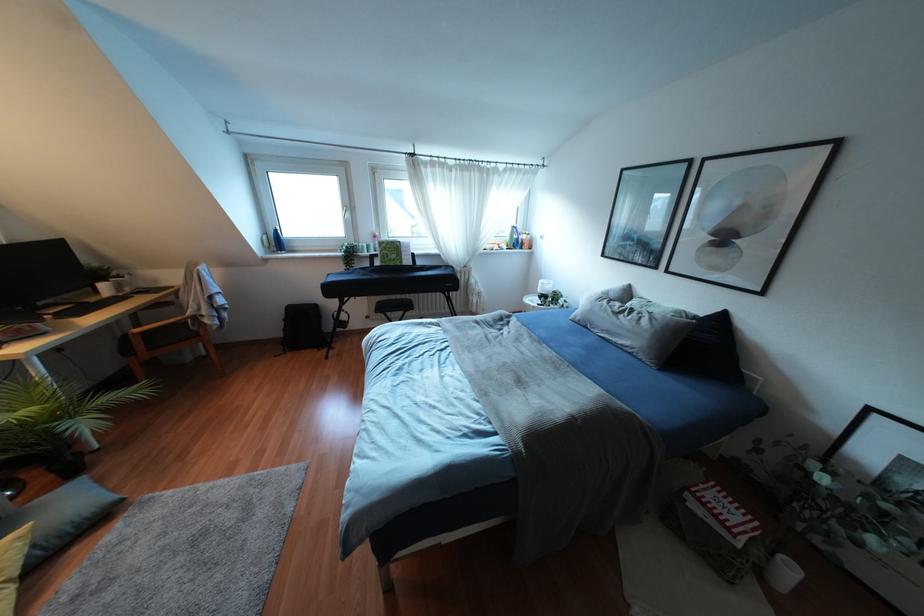
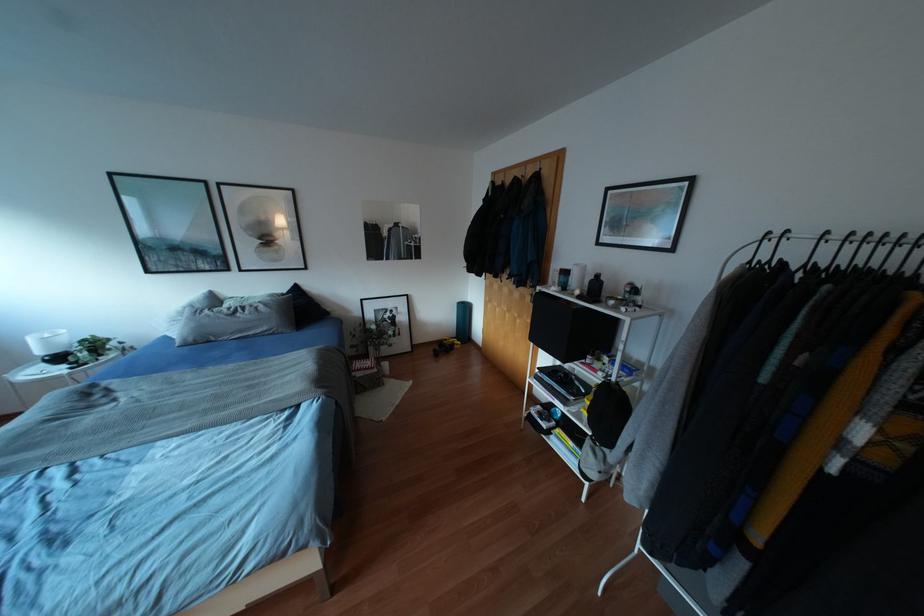
The images are taken continuously from a first-person perspective. In which direction is your viewpoint rotating?

The camera's rotation is toward right-down.